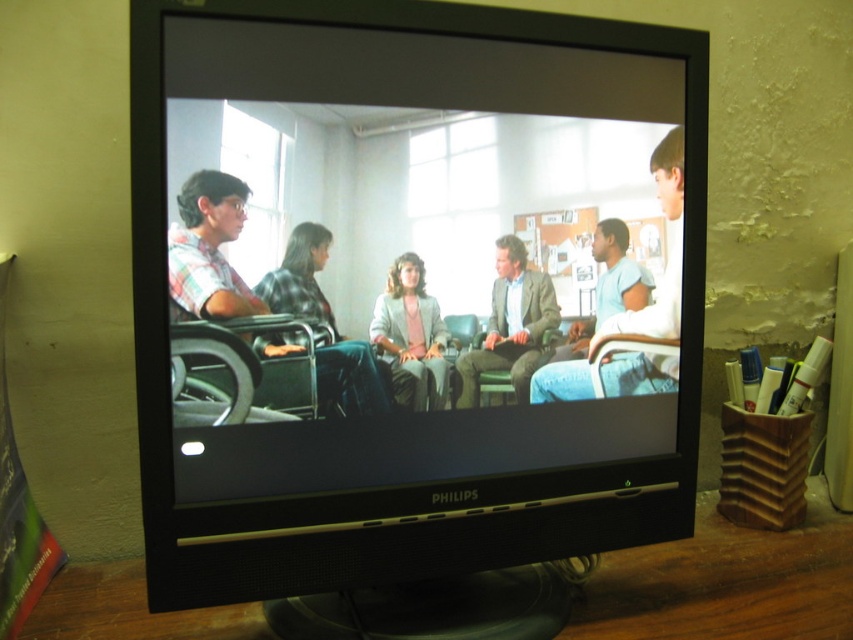
The height and width of the screenshot is (640, 853). What do you see at coordinates (425, 291) in the screenshot? I see `black plastic monitor at center` at bounding box center [425, 291].

Does black plastic monitor at center appear on the left side of matte gray blazer at center?

No, black plastic monitor at center is not to the left of matte gray blazer at center.

Is point (283, 160) positioned behind point (401, 317)?

No.

Locate an element on the screen. This screenshot has height=640, width=853. black plastic monitor at center is located at coordinates (425, 291).

Who is lower down, light blue fabric shirt at right or green textured suit at center?

green textured suit at center

Does light blue fabric shirt at right have a smaller size compared to green textured suit at center?

Incorrect, light blue fabric shirt at right is not smaller in size than green textured suit at center.

The image size is (853, 640). I want to click on light blue fabric shirt at right, so click(666, 260).

Who is shorter, black plastic monitor at center or light blue fabric shirt at right?

light blue fabric shirt at right is shorter.

The width and height of the screenshot is (853, 640). What do you see at coordinates (425, 291) in the screenshot? I see `black plastic monitor at center` at bounding box center [425, 291].

Image resolution: width=853 pixels, height=640 pixels. I want to click on black plastic monitor at center, so 425,291.